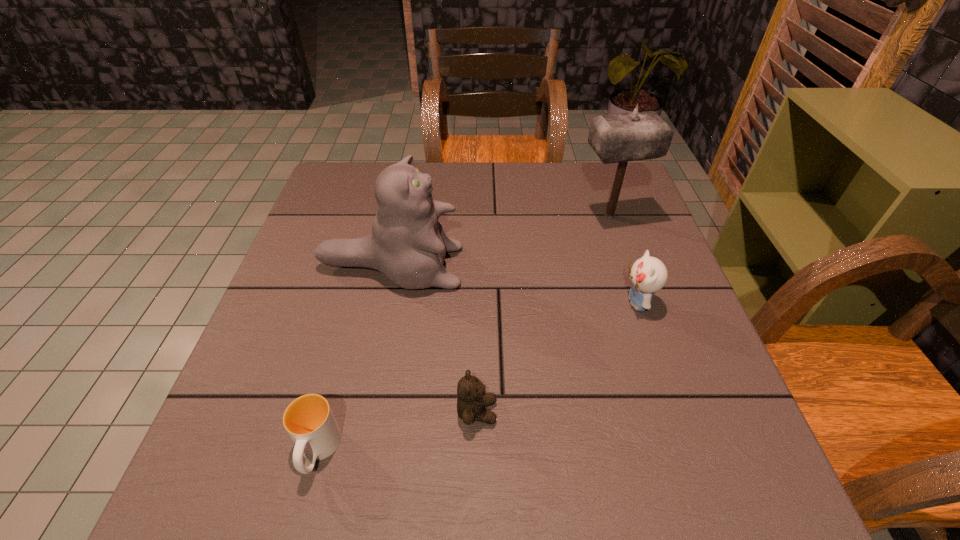
Find the location of a particular element. free space at the near edge of the desktop is located at coordinates (397, 501).

At what (x,y) coordinates should I click in order to perform the action: click on vacant area at the left edge. Please return your answer as a coordinate pair (x, y). The height and width of the screenshot is (540, 960). Looking at the image, I should click on (342, 269).

What are the coordinates of `vacant space at the right edge of the desktop` in the screenshot? It's located at (628, 280).

The image size is (960, 540). In the image, there is a desktop. Find the location of `free region at the far left corner`. free region at the far left corner is located at coordinates (350, 176).

Find the location of a particular element. The height and width of the screenshot is (540, 960). vacant space at the near left corner of the desktop is located at coordinates (225, 477).

You are a GUI agent. You are given a task and a screenshot of the screen. Output one action in this format:
    pyautogui.click(x=<x>, y=<y>)
    Task: Click on the free space at the near right corner
    The width and height of the screenshot is (960, 540).
    Given the screenshot: What is the action you would take?
    pyautogui.click(x=769, y=509)

Locate an element on the screen. This screenshot has width=960, height=540. free space between the farthest object and the kitten is located at coordinates (623, 259).

This screenshot has width=960, height=540. In order to click on free point between the cup and the third tallest object in this screenshot , I will do `click(477, 377)`.

You are a GUI agent. You are given a task and a screenshot of the screen. Output one action in this format:
    pyautogui.click(x=<x>, y=<y>)
    Task: Click on the unoccupied position between the cup and the mallet
    Image resolution: width=960 pixels, height=540 pixels.
    Given the screenshot: What is the action you would take?
    pyautogui.click(x=464, y=334)

Locate an element on the screen. free point between the teddy bear and the mallet is located at coordinates (543, 314).